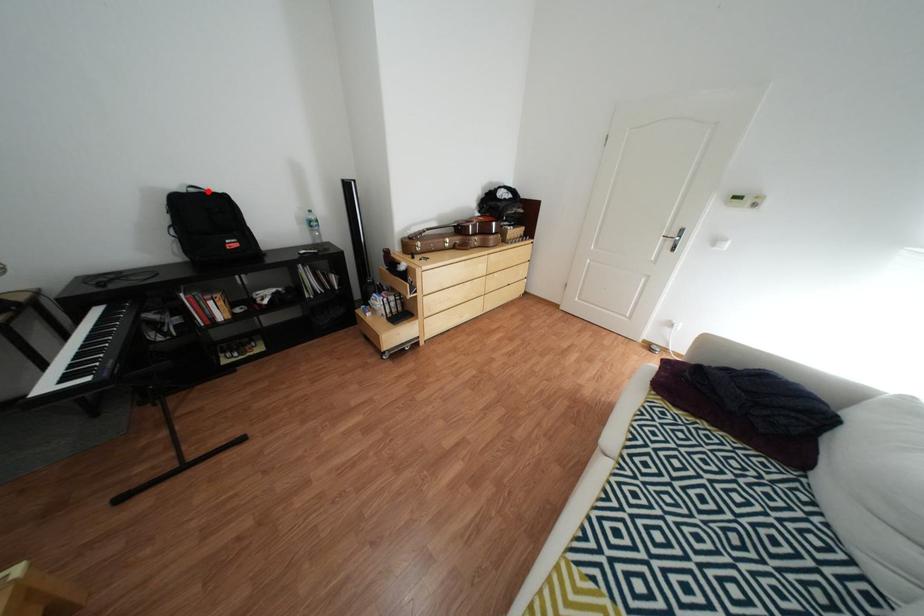
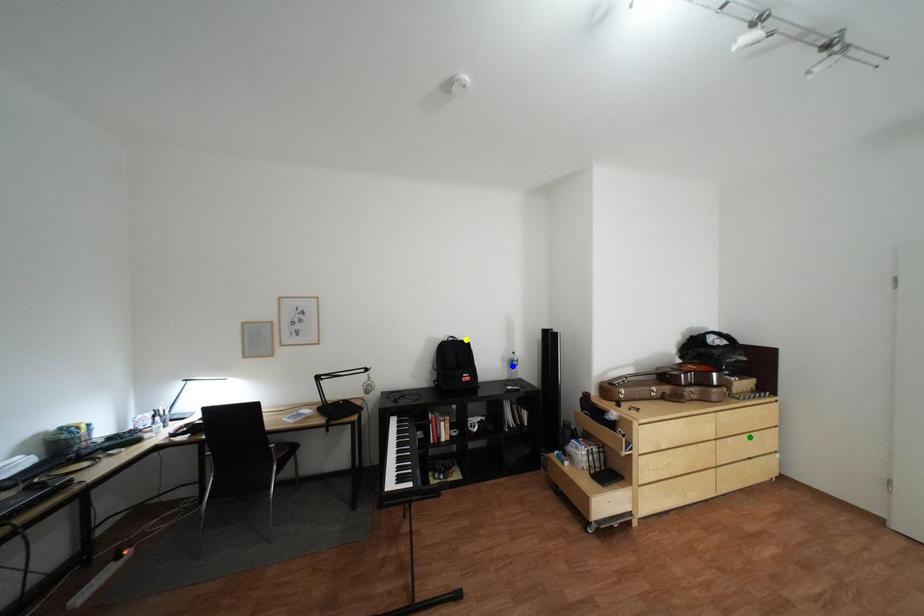
Question: I am providing you with two images of the same scene from different viewpoints. A red point is marked on the first image. You are given multiple points on the second image. In image 2, which mark is for the same physical point as the one in image 1?

Choices:
 (A) blue point
 (B) green point
 (C) yellow point

Answer: (C)